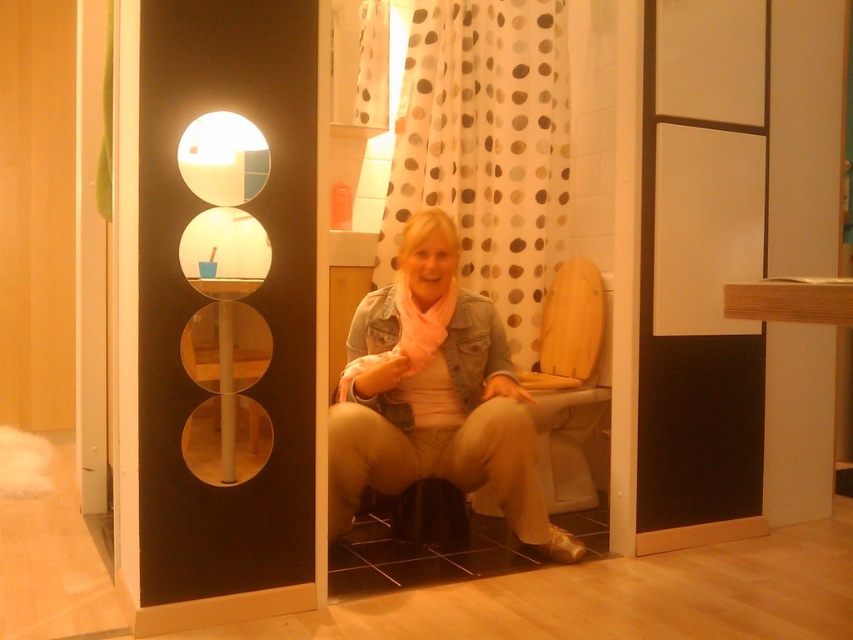
Based on the photo, you are designing a bathroom layout and need to know the spatial relationship between the white polka dot fabric at upper center and the wooden at center. Which object is wider?

The white polka dot fabric at upper center is wider than the wooden at center.

You are a photographer setting up a shoot in this bathroom. You need to position a small prop between the denim jacket at center and the wooden at center so it appears centered in the photo. Given their relative distances, where should you place the prop?

The denim jacket at center is closer to the viewer than the wooden at center. To make the prop appear centered, place it closer to the wooden at center since it is farther away, balancing the distances visually.